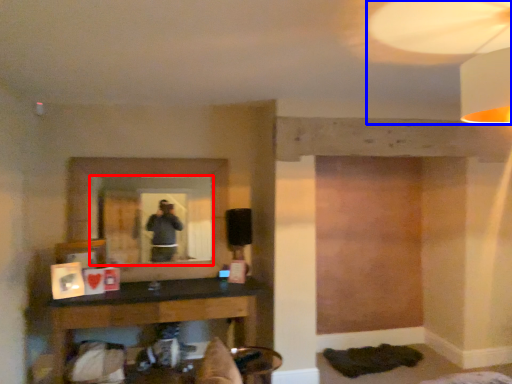
Question: Which of the following is the closest to the observer, mirror (highlighted by a red box) or mechanical fan (highlighted by a blue box)?

Choices:
 (A) mirror
 (B) mechanical fan

Answer: (B)